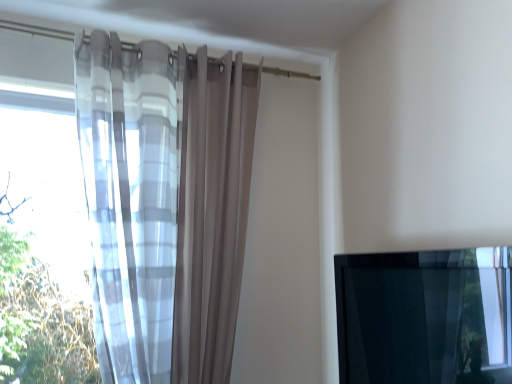
This screenshot has height=384, width=512. What do you see at coordinates (165, 205) in the screenshot? I see `translucent fabric curtain at left` at bounding box center [165, 205].

This screenshot has height=384, width=512. I want to click on translucent fabric curtain at left, so click(165, 205).

You are a GUI agent. You are given a task and a screenshot of the screen. Output one action in this format:
    pyautogui.click(x=<x>, y=<y>)
    Task: Click on the transparent glass window at lower right
    Image resolution: width=512 pixels, height=384 pixels.
    Given the screenshot: What is the action you would take?
    pyautogui.click(x=424, y=316)

What do you see at coordinates (424, 316) in the screenshot?
I see `transparent glass window at lower right` at bounding box center [424, 316].

The width and height of the screenshot is (512, 384). Identify the location of translucent fabric curtain at left. (165, 205).

Based on their positions, is translucent fabric curtain at left located to the left or right of transparent glass window at lower right?

In the image, translucent fabric curtain at left appears on the left side of transparent glass window at lower right.

Which object is further away from the camera taking this photo, translucent fabric curtain at left or transparent glass window at lower right?

translucent fabric curtain at left is behind.

Which point is more distant from viewer, (151,199) or (480,353)?

Point (151,199)

From the image's perspective, is translucent fabric curtain at left beneath transparent glass window at lower right?

No, from the image's perspective, translucent fabric curtain at left is not below transparent glass window at lower right.

From a real-world perspective, relative to transparent glass window at lower right, is translucent fabric curtain at left vertically above or below?

From a real-world perspective, translucent fabric curtain at left is physically above transparent glass window at lower right.

Can you confirm if translucent fabric curtain at left is wider than transparent glass window at lower right?

Indeed, translucent fabric curtain at left has a greater width compared to transparent glass window at lower right.

Does translucent fabric curtain at left have a greater height compared to transparent glass window at lower right?

Correct, translucent fabric curtain at left is much taller as transparent glass window at lower right.

Between translucent fabric curtain at left and transparent glass window at lower right, which one has smaller size?

transparent glass window at lower right.

Is transparent glass window at lower right located within translucent fabric curtain at left?

No, transparent glass window at lower right is not inside translucent fabric curtain at left.

Is translucent fabric curtain at left not close to transparent glass window at lower right?

No, translucent fabric curtain at left is not far from transparent glass window at lower right.

Is translucent fabric curtain at left oriented away from transparent glass window at lower right?

No, translucent fabric curtain at left is not facing the opposite direction of transparent glass window at lower right.

Measure the distance from translucent fabric curtain at left to transparent glass window at lower right.

translucent fabric curtain at left and transparent glass window at lower right are 88.54 centimeters apart.

At what (x,y) coordinates should I click in order to perform the action: click on window in front of the translucent fabric curtain at left. Please return your answer as a coordinate pair (x, y). Looking at the image, I should click on (424, 316).

Does transparent glass window at lower right appear on the right side of translucent fabric curtain at left?

Indeed, transparent glass window at lower right is positioned on the right side of translucent fabric curtain at left.

Relative to translucent fabric curtain at left, is transparent glass window at lower right in front or behind?

In the image, transparent glass window at lower right appears in front of translucent fabric curtain at left.

Which is nearer, [450,372] or [222,277]?

Clearly, point [450,372] is closer to the camera than point [222,277].

Looking at this image, from the image's perspective, does transparent glass window at lower right appear lower than translucent fabric curtain at left?

Yes, from the image's perspective, transparent glass window at lower right is below translucent fabric curtain at left.

From a real-world perspective, is transparent glass window at lower right under translucent fabric curtain at left?

Yes.

Consider the image. Which of these two, transparent glass window at lower right or translucent fabric curtain at left, is wider?

With larger width is translucent fabric curtain at left.

Who is taller, transparent glass window at lower right or translucent fabric curtain at left?

With more height is translucent fabric curtain at left.

Considering the sizes of transparent glass window at lower right and translucent fabric curtain at left in the image, is transparent glass window at lower right bigger or smaller than translucent fabric curtain at left?

In the image, transparent glass window at lower right appears to be smaller than translucent fabric curtain at left.

Would you say transparent glass window at lower right is inside or outside translucent fabric curtain at left?

transparent glass window at lower right is not inside translucent fabric curtain at left, it's outside.

Is transparent glass window at lower right not close to translucent fabric curtain at left?

No, transparent glass window at lower right is in close proximity to translucent fabric curtain at left.

Could you tell me if transparent glass window at lower right is facing translucent fabric curtain at left?

Yes, transparent glass window at lower right is facing translucent fabric curtain at left.

This screenshot has width=512, height=384. Find the location of `curtain above the transparent glass window at lower right (from the image's perspective)`. curtain above the transparent glass window at lower right (from the image's perspective) is located at coordinates (165, 205).

Image resolution: width=512 pixels, height=384 pixels. I want to click on window below the translucent fabric curtain at left (from a real-world perspective), so click(x=424, y=316).

The height and width of the screenshot is (384, 512). Identify the location of curtain located above the transparent glass window at lower right (from a real-world perspective). (x=165, y=205).